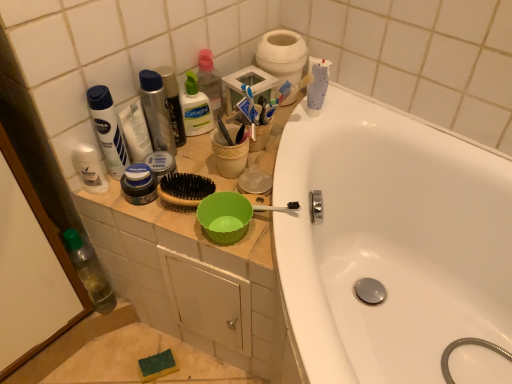
Question: From the image's perspective, does white matte lotion at upper left, placed as the 2th toiletry when sorted from left to right, appear higher than metallic silver mouthwash at center, the 2th mouthwash positioned from the left?

Choices:
 (A) yes
 (B) no

Answer: (B)

Question: Is white matte lotion at upper left, placed as the 2th toiletry when sorted from left to right, thinner than metallic silver mouthwash at center, the 2th mouthwash positioned from the left?

Choices:
 (A) no
 (B) yes

Answer: (B)

Question: Is white matte lotion at upper left, placed as the 2th toiletry when sorted from left to right, not close to metallic silver mouthwash at center, which ranks as the 1th mouthwash in right-to-left order?

Choices:
 (A) no
 (B) yes

Answer: (A)

Question: Considering the relative sizes of white matte lotion at upper left, placed as the 2th toiletry when sorted from left to right, and metallic silver mouthwash at center, the 2th mouthwash positioned from the left, in the image provided, is white matte lotion at upper left, placed as the 2th toiletry when sorted from left to right, bigger than metallic silver mouthwash at center, the 2th mouthwash positioned from the left,?

Choices:
 (A) no
 (B) yes

Answer: (A)

Question: Is white matte lotion at upper left, which is the 2th toiletry in right-to-left order, shorter than metallic silver mouthwash at center, the 2th mouthwash positioned from the left?

Choices:
 (A) no
 (B) yes

Answer: (A)

Question: From a real-world perspective, is white matte toilet paper at upper center physically located above or below metallic silver mouthwash at upper center, the 2th mouthwash from the right?

Choices:
 (A) above
 (B) below

Answer: (B)

Question: In terms of width, does white matte toilet paper at upper center look wider or thinner when compared to metallic silver mouthwash at upper center, the 2th mouthwash from the right?

Choices:
 (A) wide
 (B) thin

Answer: (A)

Question: From the image's perspective, relative to metallic silver mouthwash at upper center, which ranks as the first mouthwash in left-to-right order, is white matte toilet paper at upper center above or below?

Choices:
 (A) below
 (B) above

Answer: (B)

Question: Would you say white matte toilet paper at upper center is to the left or to the right of metallic silver mouthwash at upper center, the 2th mouthwash from the right, in the picture?

Choices:
 (A) right
 (B) left

Answer: (A)

Question: Relative to metallic silver mouthwash at center, which ranks as the 1th mouthwash in right-to-left order, is white matte toilet paper at upper center in front or behind?

Choices:
 (A) behind
 (B) front

Answer: (A)

Question: Considering the positions of white matte toilet paper at upper center and metallic silver mouthwash at center, which ranks as the 1th mouthwash in right-to-left order, in the image, is white matte toilet paper at upper center wider or thinner than metallic silver mouthwash at center, which ranks as the 1th mouthwash in right-to-left order,?

Choices:
 (A) thin
 (B) wide

Answer: (B)

Question: From their relative heights in the image, would you say white matte toilet paper at upper center is taller or shorter than metallic silver mouthwash at center, the 2th mouthwash positioned from the left?

Choices:
 (A) short
 (B) tall

Answer: (A)

Question: Do you think white matte toilet paper at upper center is within metallic silver mouthwash at center, the 2th mouthwash positioned from the left, or outside of it?

Choices:
 (A) inside
 (B) outside

Answer: (B)

Question: From the image's perspective, relative to transparent plastic bottle at lower left, is white matte lotion at upper left, which is the 2th toiletry in right-to-left order, above or below?

Choices:
 (A) above
 (B) below

Answer: (A)

Question: Is white matte lotion at upper left, placed as the 2th toiletry when sorted from left to right, wider or thinner than transparent plastic bottle at lower left?

Choices:
 (A) thin
 (B) wide

Answer: (A)